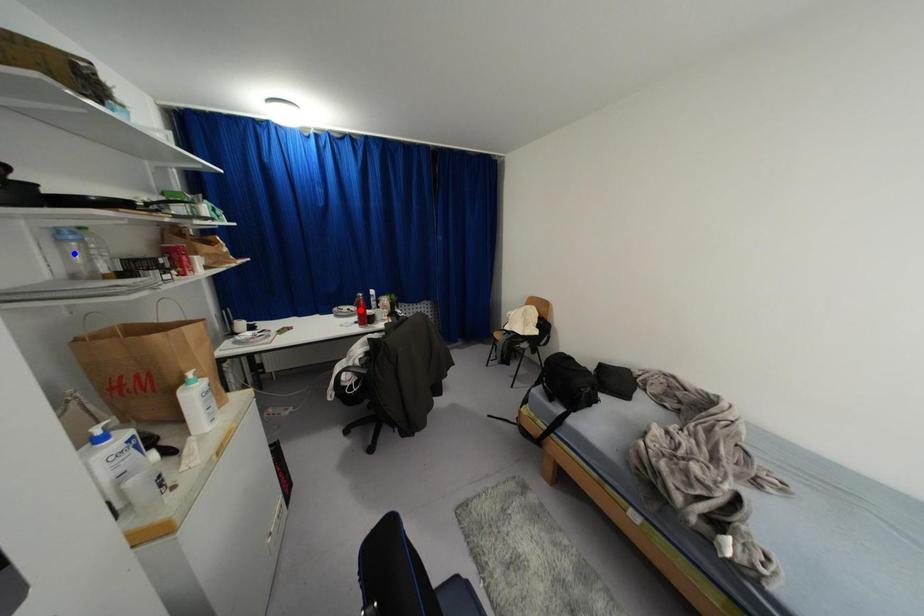
Question: Which of the two points in the image is closer to the camera?

Choices:
 (A) Blue point is closer.
 (B) Red point is closer.

Answer: (A)